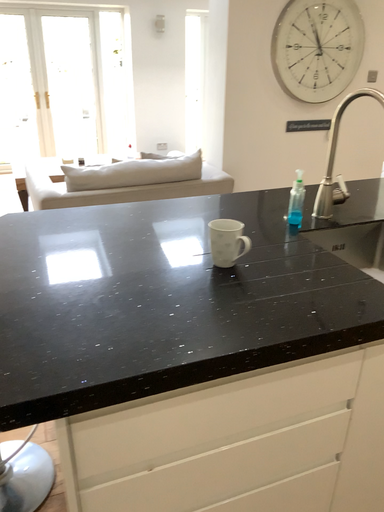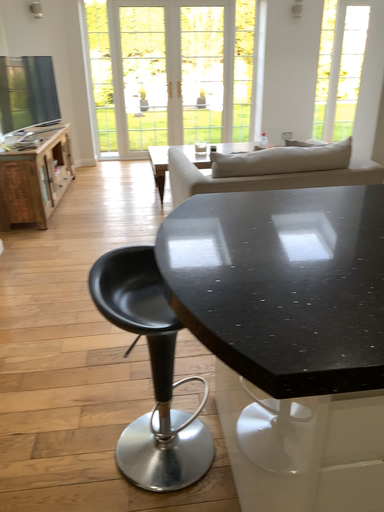
Question: Which way did the camera rotate in the video?

Choices:
 (A) rotated right
 (B) rotated left

Answer: (B)